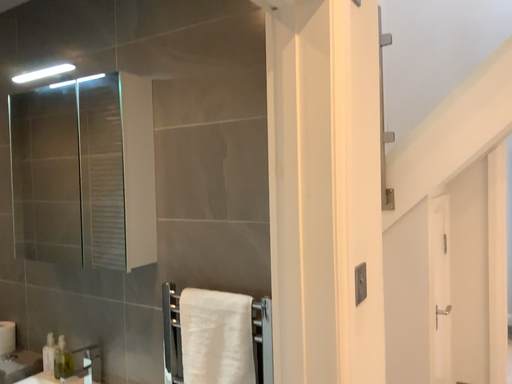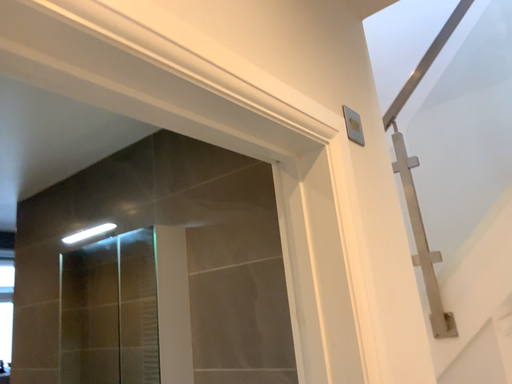
Question: How did the camera likely rotate when shooting the video?

Choices:
 (A) rotated downward
 (B) rotated upward

Answer: (B)